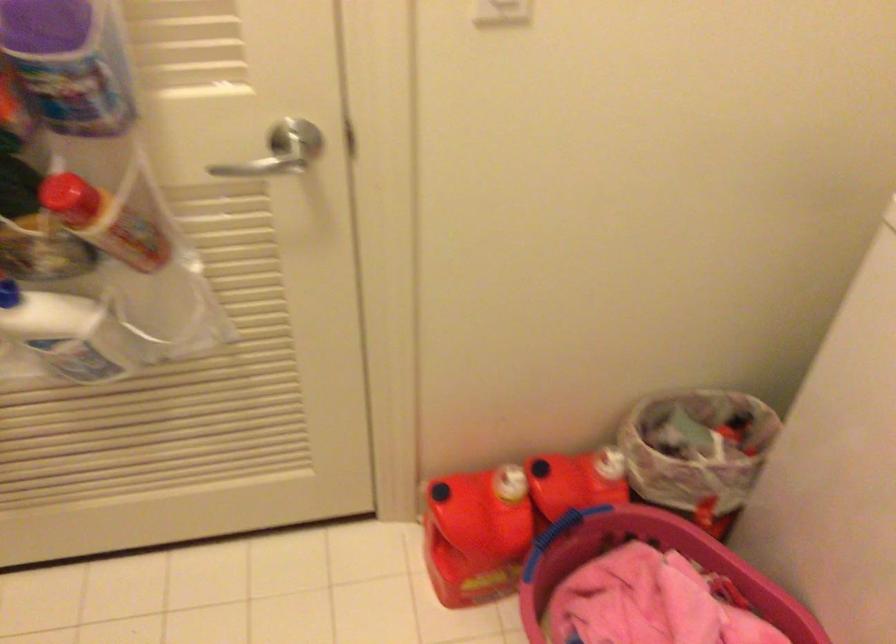
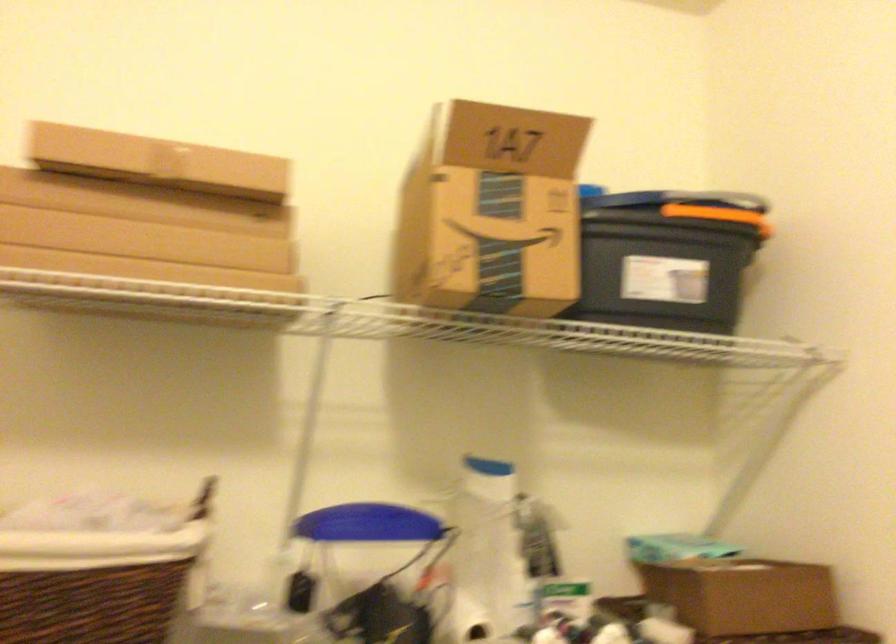
Question: Based on the continuous images, in which direction is the camera rotating? Reply with the corresponding letter.

Choices:
 (A) Left
 (B) Right
 (C) Up
 (D) Down

Answer: (B)